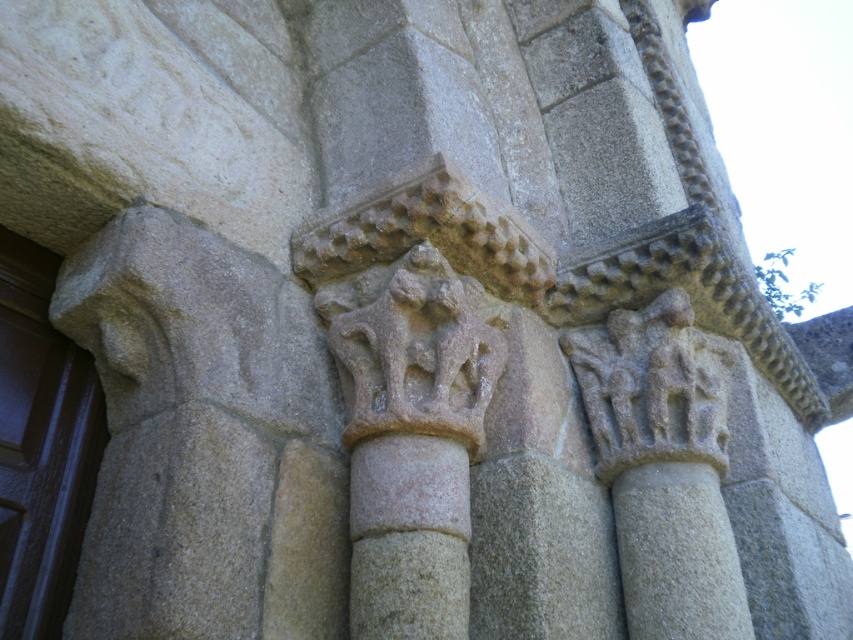
Looking at this image, you are an architect examining the stone structure. You notice the gray stone carving at center and the pink stone column at center. Which object is located above the other?

The gray stone carving at center is positioned over the pink stone column at center.

You are standing in front of the stone architectural structure. You want to take a photo of the point at coordinates (700, 385). If your camera is 1.85 meters away from that point, will you be able to capture the entire structure in the frame?

The point at coordinates (700, 385) is 1.85 meters away from the camera. However, the question of whether the entire structure can be captured depends on the camera lens and field of view, which are not provided. Thus, it cannot be determined with the given information.